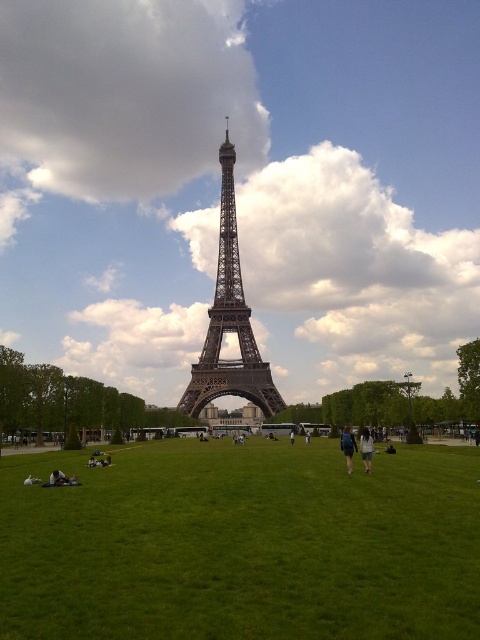
Based on the photo, is dark blue jeans at center further to camera compared to dark blue fabric jacket at lower center?

Yes, it is.

Does dark blue jeans at center have a greater width compared to dark blue fabric jacket at lower center?

Yes.

Where is `dark blue jeans at center`? The image size is (480, 640). dark blue jeans at center is located at coordinates (348, 445).

What do you see at coordinates (242, 545) in the screenshot? I see `green grass at center` at bounding box center [242, 545].

Is green grass at center behind dark blue jeans at center?

No.

At what (x,y) coordinates should I click in order to perform the action: click on green grass at center. Please return your answer as a coordinate pair (x, y). Looking at the image, I should click on (242, 545).

This screenshot has height=640, width=480. In order to click on green grass at center in this screenshot , I will do `click(242, 545)`.

Describe the element at coordinates (229, 323) in the screenshot. This screenshot has height=640, width=480. I see `metallic gray eiffel tower at center` at that location.

Based on the photo, does metallic gray eiffel tower at center have a larger size compared to dark blue jeans at center?

Yes, metallic gray eiffel tower at center is bigger than dark blue jeans at center.

Measure the distance between point (235, 209) and camera.

Point (235, 209) and camera are 203.61 meters apart from each other.

Where is `metallic gray eiffel tower at center`? metallic gray eiffel tower at center is located at coordinates (229, 323).